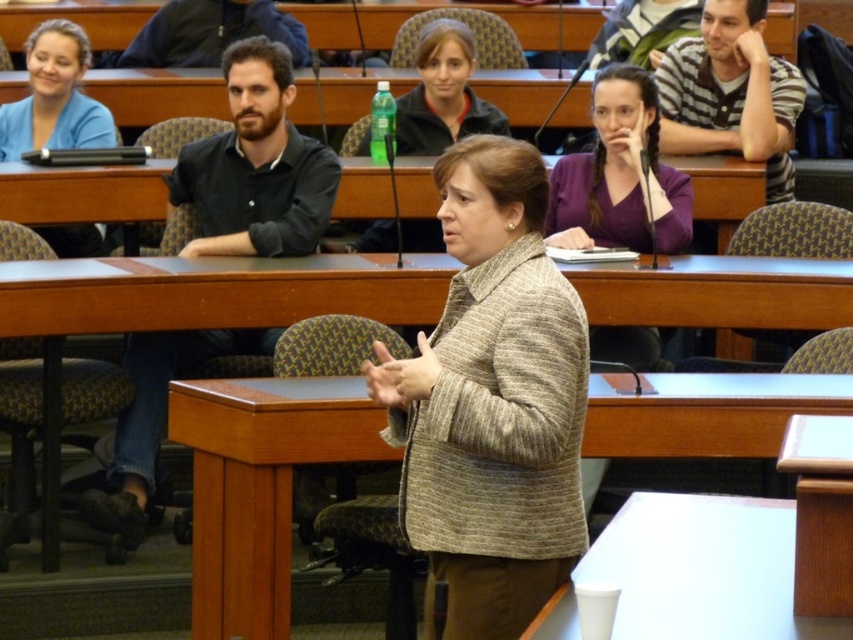
Question: Is wooden table at center further to the viewer compared to blue cotton shirt at upper left?

Choices:
 (A) no
 (B) yes

Answer: (A)

Question: Which point is farther from the camera taking this photo?

Choices:
 (A) (456, 464)
 (B) (753, 586)
 (C) (677, 179)

Answer: (C)

Question: Based on their relative distances, which object is nearer to the dark blue jacket at upper left?

Choices:
 (A) matte black jacket at upper center
 (B) white plastic cup at lower center

Answer: (A)

Question: Does wooden table at center have a smaller size compared to blue cotton shirt at upper left?

Choices:
 (A) yes
 (B) no

Answer: (B)

Question: In this image, where is wooden table at center located relative to white plastic cup at lower center?

Choices:
 (A) right
 (B) left

Answer: (B)

Question: Which point is closer to the camera taking this photo?

Choices:
 (A) (779, 108)
 (B) (374, 125)

Answer: (A)